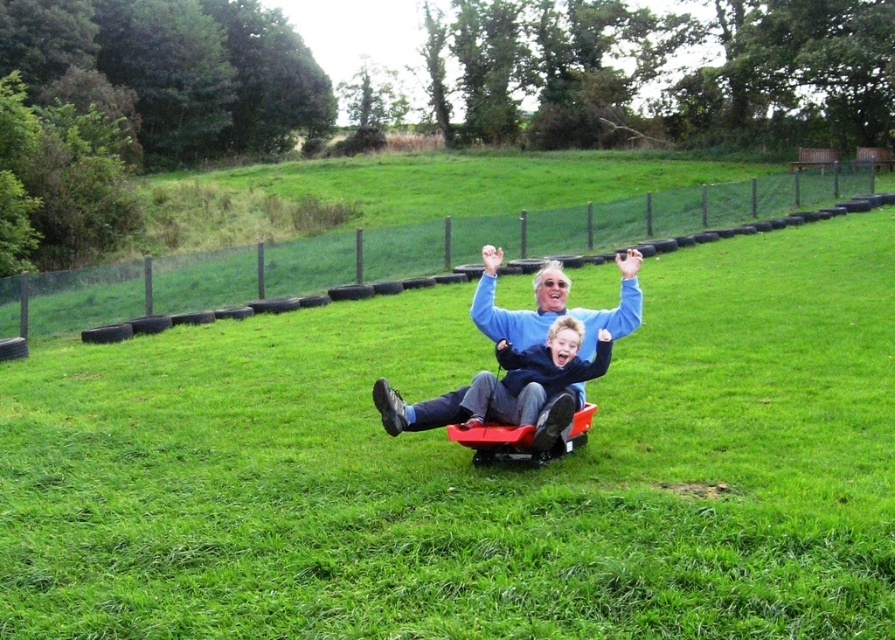
Which of these two, blue smooth sweater at center or red plastic wagon at center, stands shorter?

blue smooth sweater at center is shorter.

Can you confirm if blue smooth sweater at center is positioned to the right of red plastic wagon at center?

No, blue smooth sweater at center is not to the right of red plastic wagon at center.

Is point (374, 381) behind point (478, 432)?

Yes, point (374, 381) is behind point (478, 432).

At what (x,y) coordinates should I click in order to perform the action: click on blue smooth sweater at center. Please return your answer as a coordinate pair (x, y). This screenshot has height=640, width=895. Looking at the image, I should click on (553, 305).